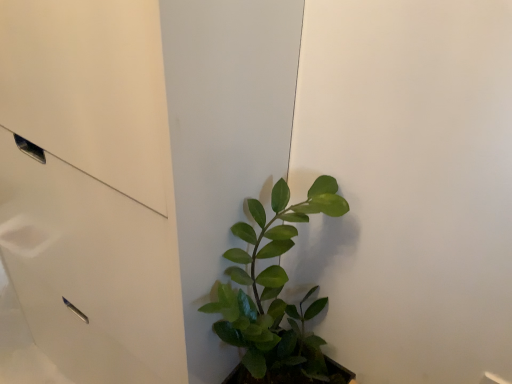
Image resolution: width=512 pixels, height=384 pixels. What do you see at coordinates (273, 287) in the screenshot?
I see `green matte plant at center` at bounding box center [273, 287].

Image resolution: width=512 pixels, height=384 pixels. I want to click on green matte plant at center, so click(x=273, y=287).

In order to face green matte plant at center, should I rotate leftwards or rightwards?

To align with it, rotate right about 3.566°.

You are a GUI agent. You are given a task and a screenshot of the screen. Output one action in this format:
    pyautogui.click(x=<x>, y=<y>)
    Task: Click on the green matte plant at center
    
    Given the screenshot: What is the action you would take?
    pyautogui.click(x=273, y=287)